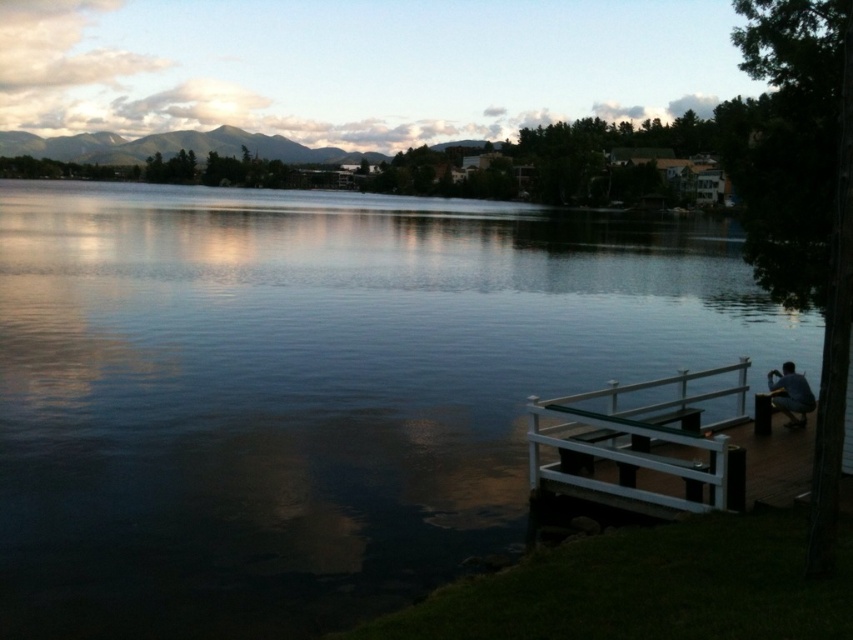
Question: Which point is closer to the camera?

Choices:
 (A) (753, 419)
 (B) (538, 472)
 (C) (273, 308)
 (D) (790, 362)

Answer: (B)

Question: Is smooth dark water at center positioned at the back of white glossy dock at lower right?

Choices:
 (A) yes
 (B) no

Answer: (B)

Question: Can you confirm if smooth dark water at center is thinner than white glossy dock at lower right?

Choices:
 (A) no
 (B) yes

Answer: (A)

Question: Does white glossy dock at lower right appear on the right side of dark blue jeans at lower right?

Choices:
 (A) no
 (B) yes

Answer: (A)

Question: Which of these objects is positioned farthest from the smooth dark water at center?

Choices:
 (A) dark blue jeans at lower right
 (B) wooden park bench at lower right
 (C) white glossy dock at lower right

Answer: (A)

Question: Which point is closer to the camera?

Choices:
 (A) dark blue jeans at lower right
 (B) white glossy dock at lower right
 (C) smooth dark water at center
 (D) wooden park bench at lower right

Answer: (C)